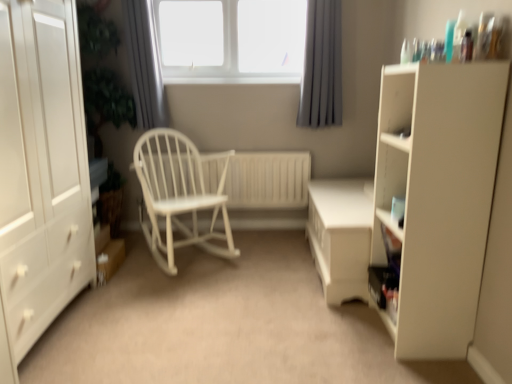
Where is `spots to the right of white wood rocking chair at center`? Image resolution: width=512 pixels, height=384 pixels. spots to the right of white wood rocking chair at center is located at coordinates (271, 261).